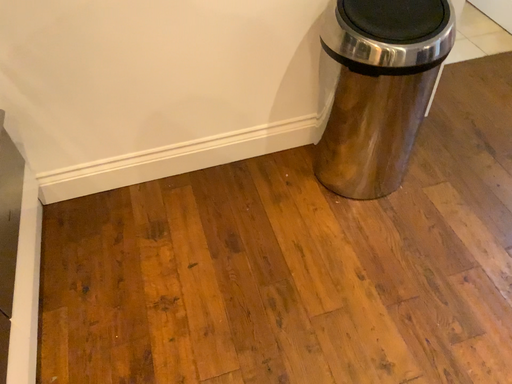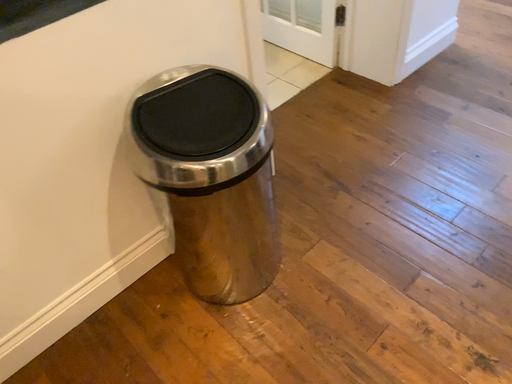
Question: Which way did the camera rotate in the video?

Choices:
 (A) rotated left
 (B) rotated right

Answer: (B)